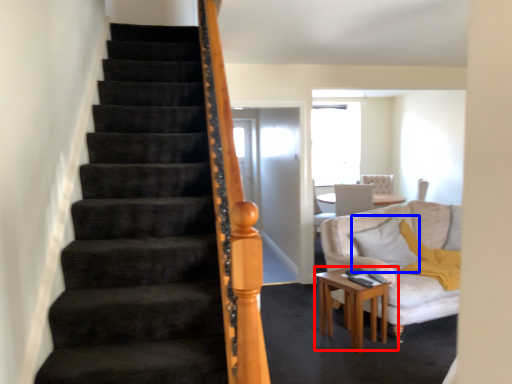
Question: Which object is closer to the camera taking this photo, table (highlighted by a red box) or pillow (highlighted by a blue box)?

Choices:
 (A) table
 (B) pillow

Answer: (A)